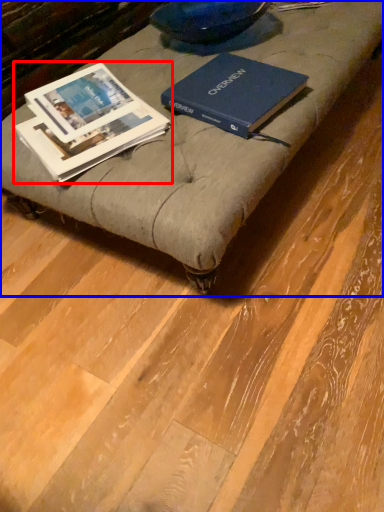
Question: Which object is further to the camera taking this photo, book (highlighted by a red box) or furniture (highlighted by a blue box)?

Choices:
 (A) book
 (B) furniture

Answer: (A)